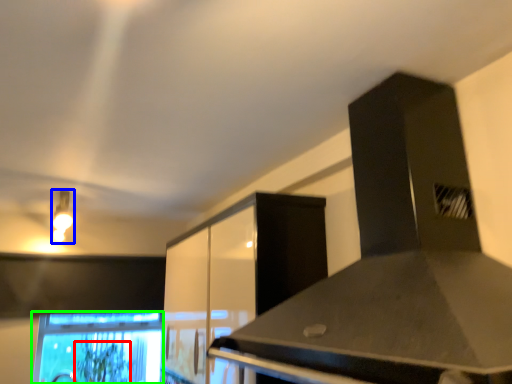
Question: Based on their relative distances, which object is farther from plant (highlighted by a red box)? Choose from light fixture (highlighted by a blue box) and computer monitor (highlighted by a green box).

Choices:
 (A) light fixture
 (B) computer monitor

Answer: (A)